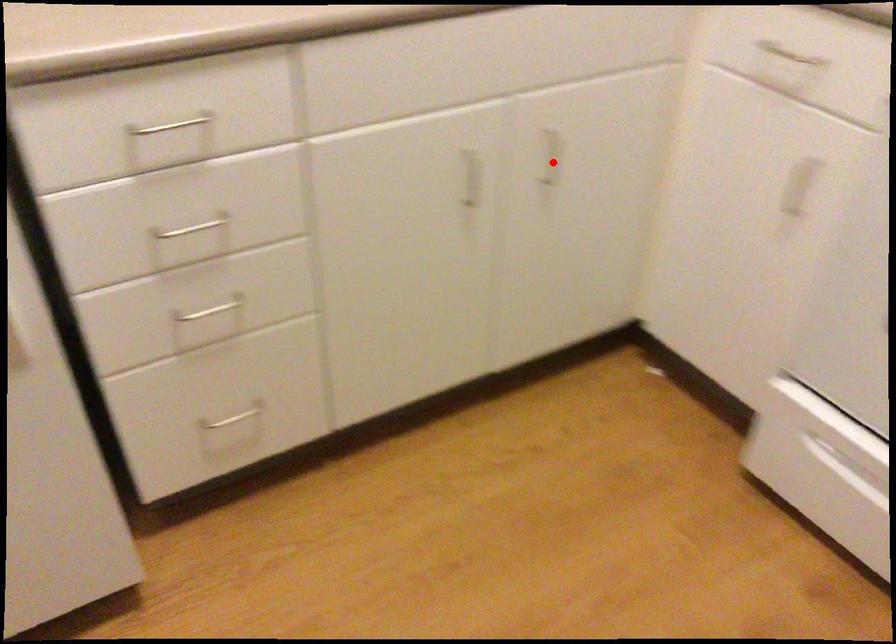
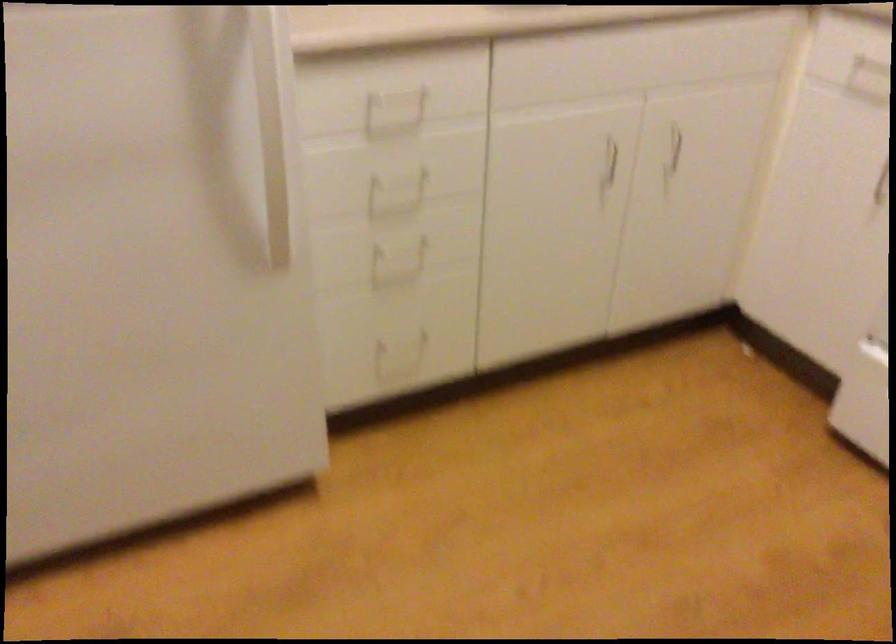
In the second image, find the point that corresponds to the highlighted location in the first image.

(675, 147)